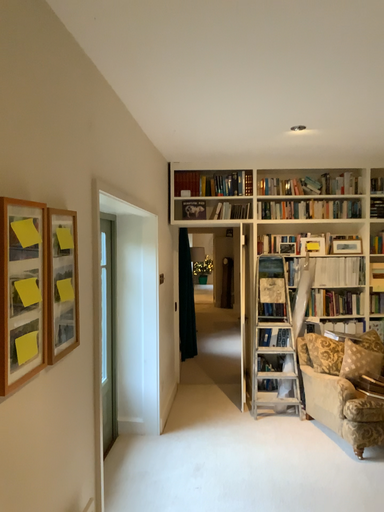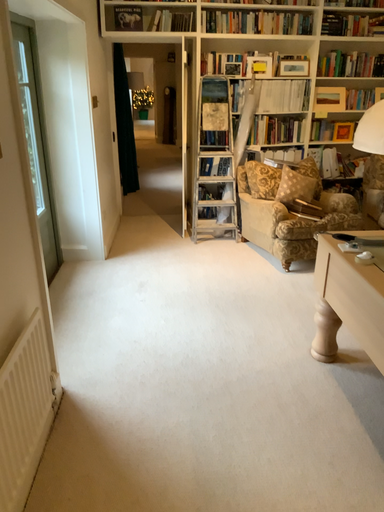
Question: How did the camera likely rotate when shooting the video?

Choices:
 (A) rotated downward
 (B) rotated upward

Answer: (A)